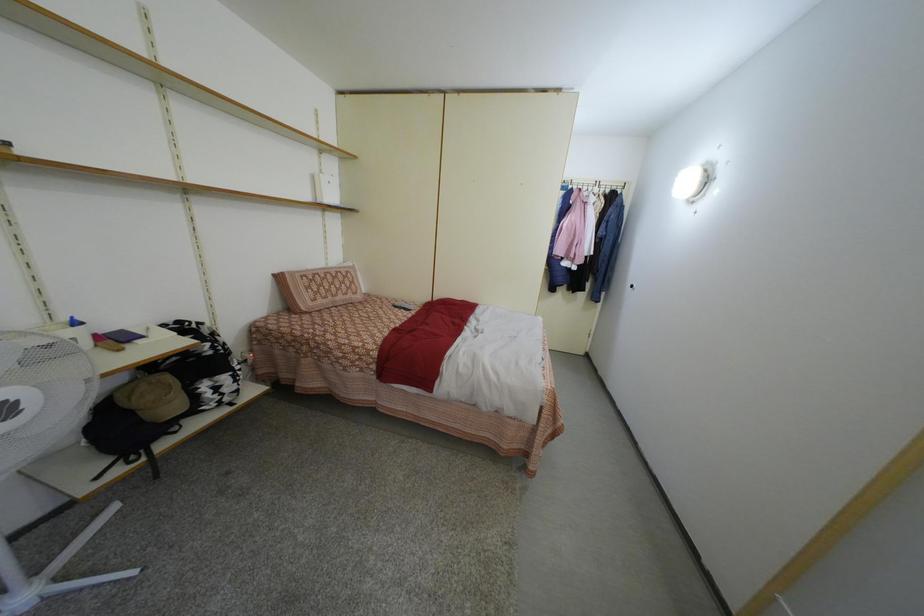
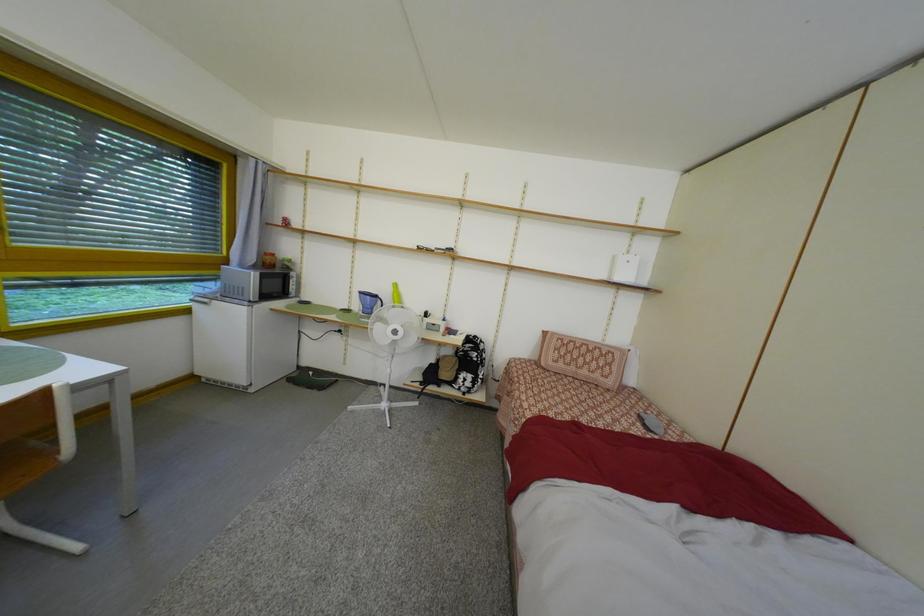
Question: Based on the continuous images, in which direction is the camera rotating? Reply with the corresponding letter.

Choices:
 (A) Left
 (B) Right
 (C) Up
 (D) Down

Answer: (A)